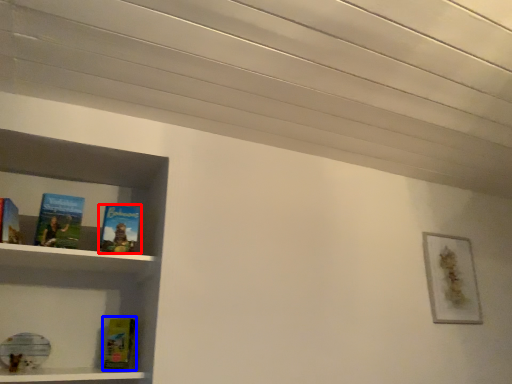
Question: Which object appears closest to the camera in this image, book (highlighted by a red box) or paperback book (highlighted by a blue box)?

Choices:
 (A) book
 (B) paperback book

Answer: (A)